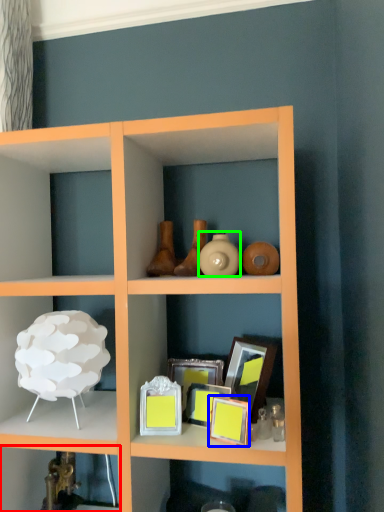
Question: Which is farther away from shelf (highlighted by a red box)? picture frame (highlighted by a blue box) or vase (highlighted by a green box)?

Choices:
 (A) picture frame
 (B) vase

Answer: (B)